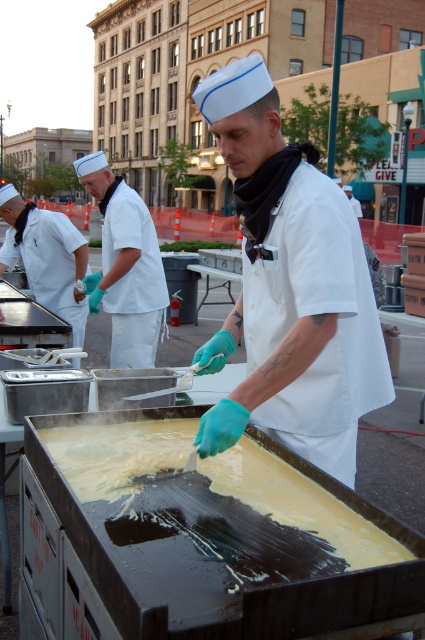
Consider the image. You are a food critic standing at the edge of the cooking area. You notice a point marked at coordinates [291,289]. What object does this point correspond to in the scene?

The point at coordinates [291,289] corresponds to the yellow matte batter at center.

You are a food critic attending a street food festival. You notice the yellow matte batter at center and the white matte chef hat at upper left. Which object would you describe as being bigger in size?

The yellow matte batter at center is larger in size than the white matte chef hat at upper left.

You are a chef standing at the cooking station. You need to reach both the yellow matte batter at center and the white matte sailor hat at upper left. Can you comfortably reach both items without moving your position?

The yellow matte batter at center and the white matte sailor hat at upper left are 1.95 meters apart from each other, so it would be difficult to comfortably reach both items without moving your position since the distance is quite large.